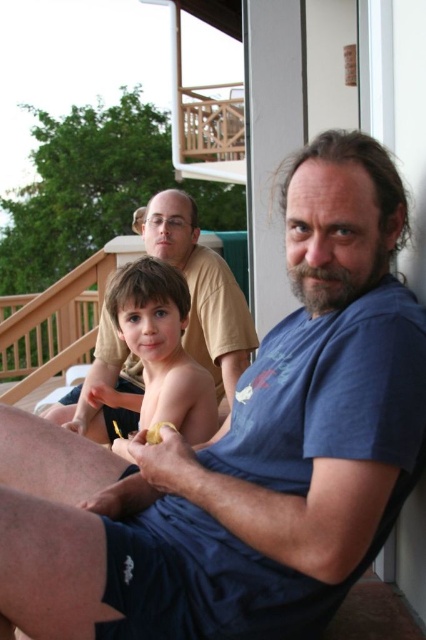
How distant is matte yellow shirt at upper center from smooth skin child at center?

13.57 inches

Is point (120, 417) positioned in front of point (161, 378)?

No, it is behind (161, 378).

In order to click on matte yellow shirt at upper center in this screenshot , I will do `click(203, 291)`.